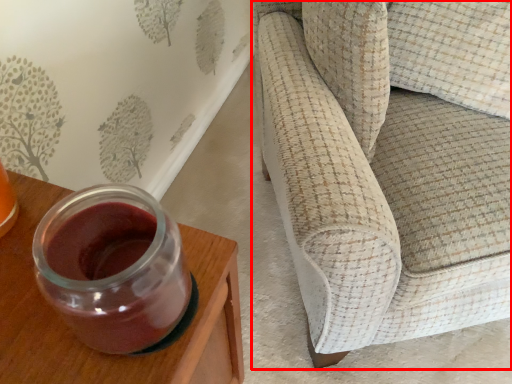
Question: From the image, what is the correct spatial relationship of studio couch (annotated by the red box) in relation to furniture?

Choices:
 (A) left
 (B) right

Answer: (B)